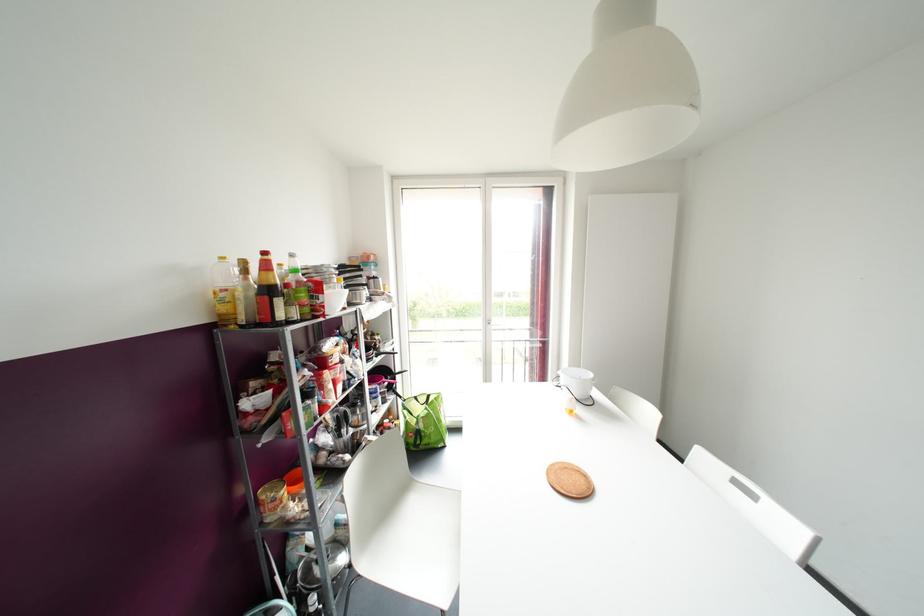
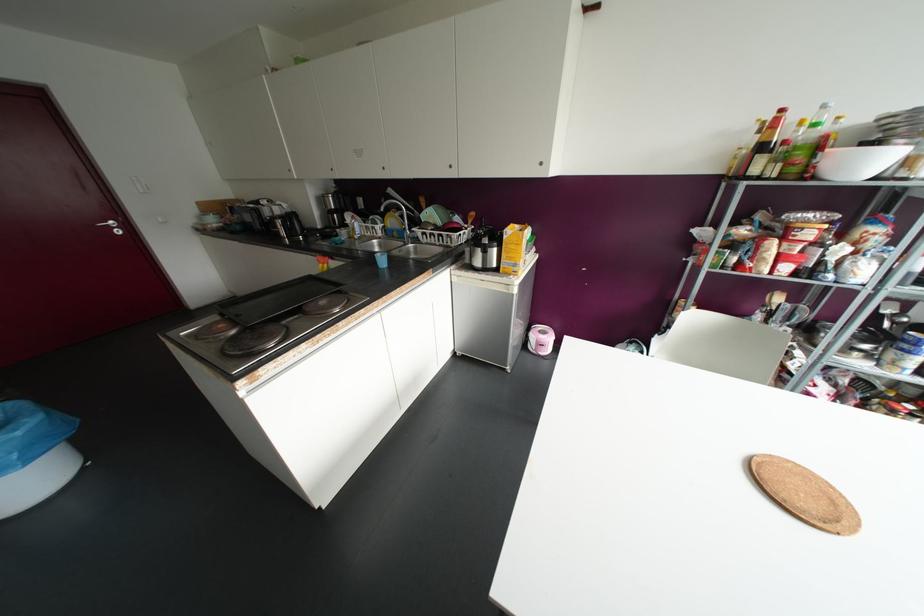
In the second image, find the point that corresponds to point (292, 254) in the first image.

(823, 106)